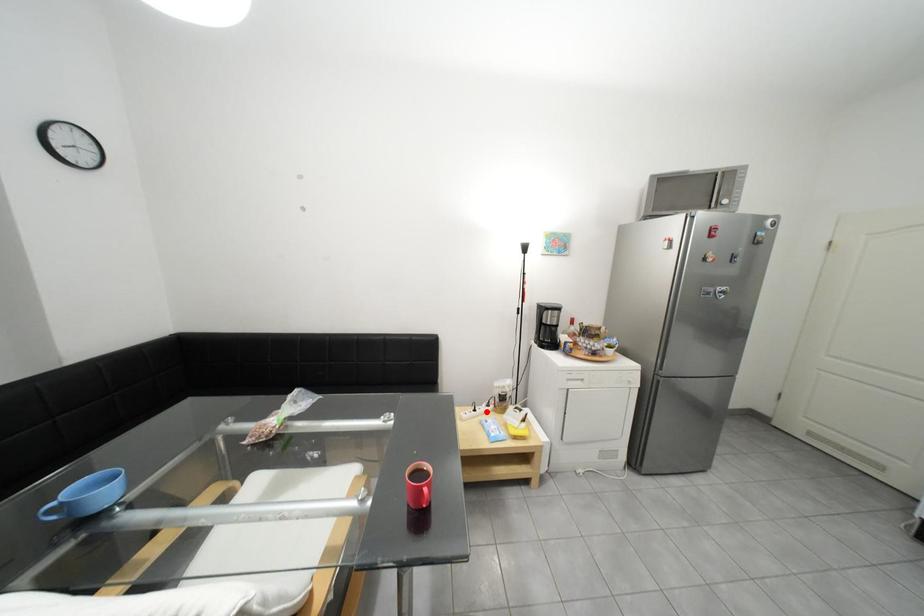
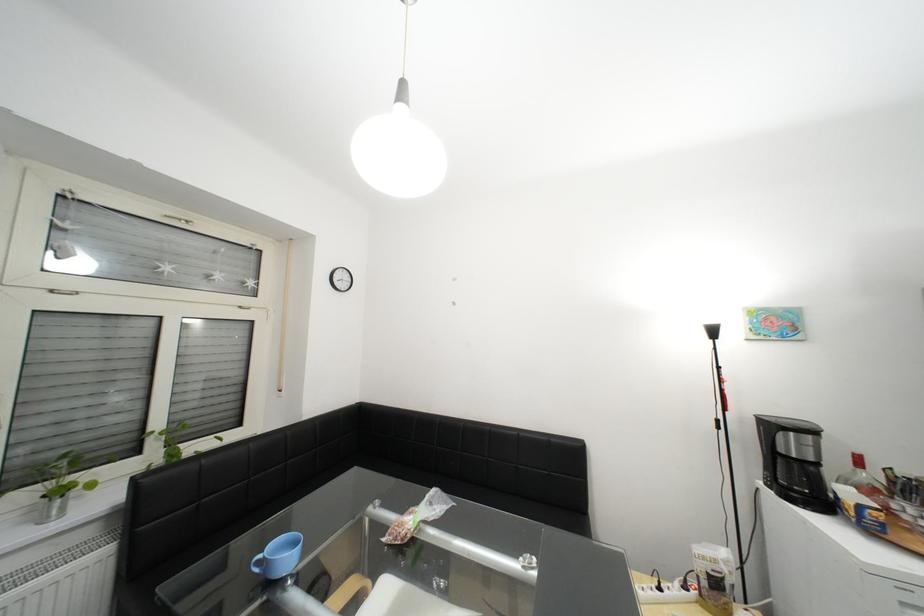
Where in the second image is the point corresponding to the highlighted location from the first image?

(672, 590)